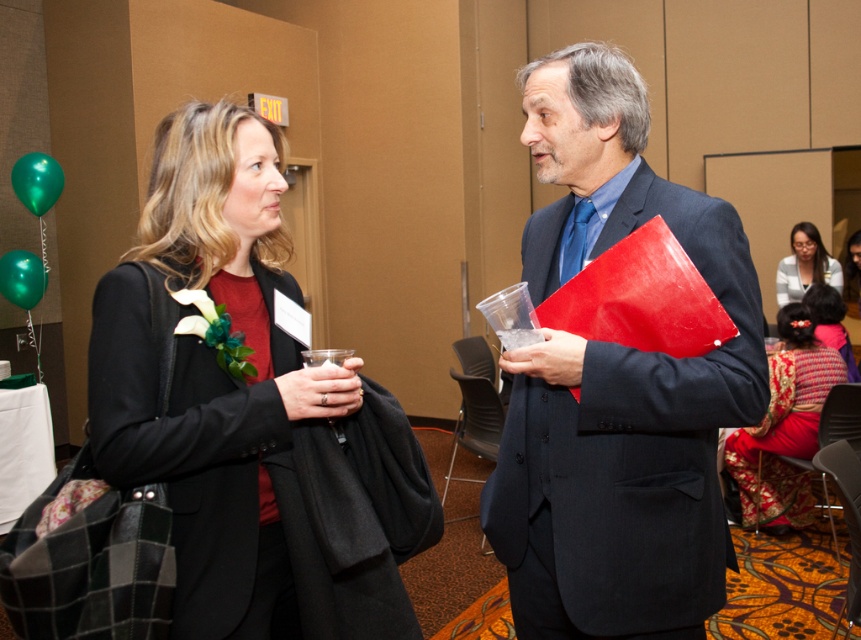
Question: Which point is farther to the camera?

Choices:
 (A) silky red dress at center
 (B) silk red dress at lower right
 (C) matte black jacket at center

Answer: (A)

Question: Does silky red dress at lower right have a larger size compared to silky red dress at center?

Choices:
 (A) no
 (B) yes

Answer: (A)

Question: Is matte black suit at center behind silky red dress at center?

Choices:
 (A) yes
 (B) no

Answer: (B)

Question: Does matte black jacket at center appear over silk red dress at lower right?

Choices:
 (A) no
 (B) yes

Answer: (B)

Question: Among these objects, which one is farthest from the camera?

Choices:
 (A) matte black suit at center
 (B) matte black jacket at center
 (C) silky red dress at lower right

Answer: (C)

Question: Which object is farther from the camera taking this photo?

Choices:
 (A) matte white blouse at upper right
 (B) silk red dress at lower right
 (C) silky red dress at center

Answer: (C)